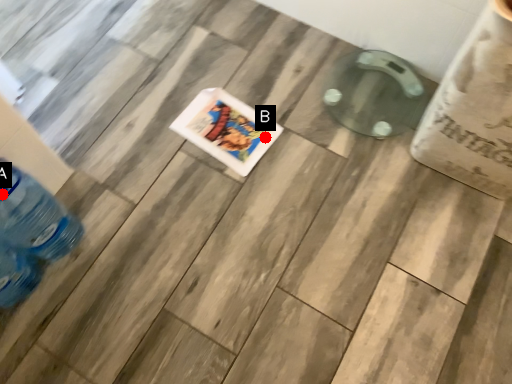
Question: Two points are circled on the image, labeled by A and B beside each circle. Which of the following is the closest to the observer?

Choices:
 (A) A is closer
 (B) B is closer

Answer: (A)